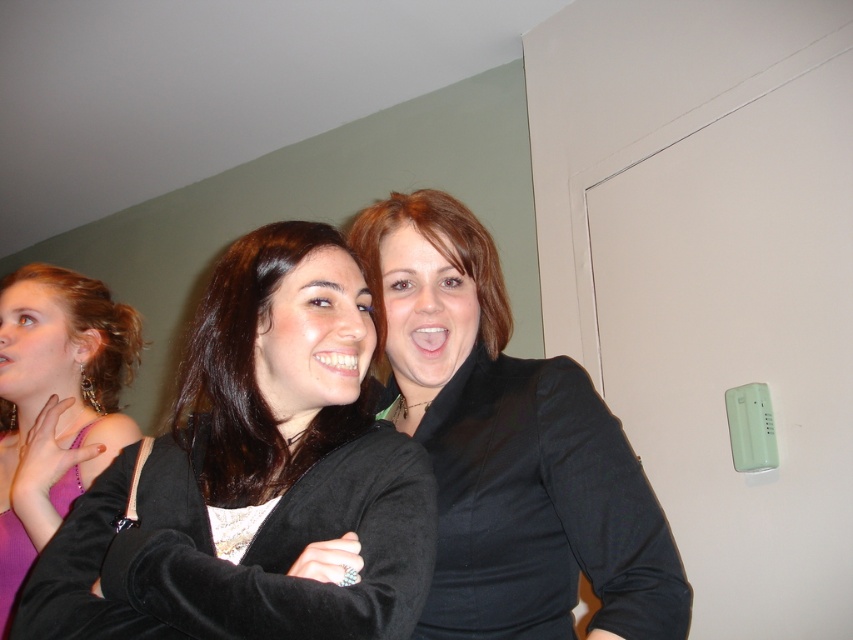
Which of these two, black velvet jacket at center or black matte jacket at center, stands taller?

With more height is black matte jacket at center.

Is black velvet jacket at center further to camera compared to black matte jacket at center?

No, black velvet jacket at center is in front of black matte jacket at center.

Which is behind, point (341, 433) or point (534, 388)?

The point (534, 388) is behind.

Image resolution: width=853 pixels, height=640 pixels. Find the location of `black velvet jacket at center`. black velvet jacket at center is located at coordinates (254, 476).

Which of these two, black velvet jacket at center or pink satin dress at left, stands taller?

pink satin dress at left is taller.

Is point (212, 467) closer to camera compared to point (4, 534)?

Yes, it is.

Where is `black velvet jacket at center`? Image resolution: width=853 pixels, height=640 pixels. black velvet jacket at center is located at coordinates (254, 476).

Is point (56, 403) farther from camera compared to point (270, 440)?

Yes.

Is pink satin dress at left behind shiny black jacket at center?

Yes, it is behind shiny black jacket at center.

Image resolution: width=853 pixels, height=640 pixels. I want to click on pink satin dress at left, so click(55, 404).